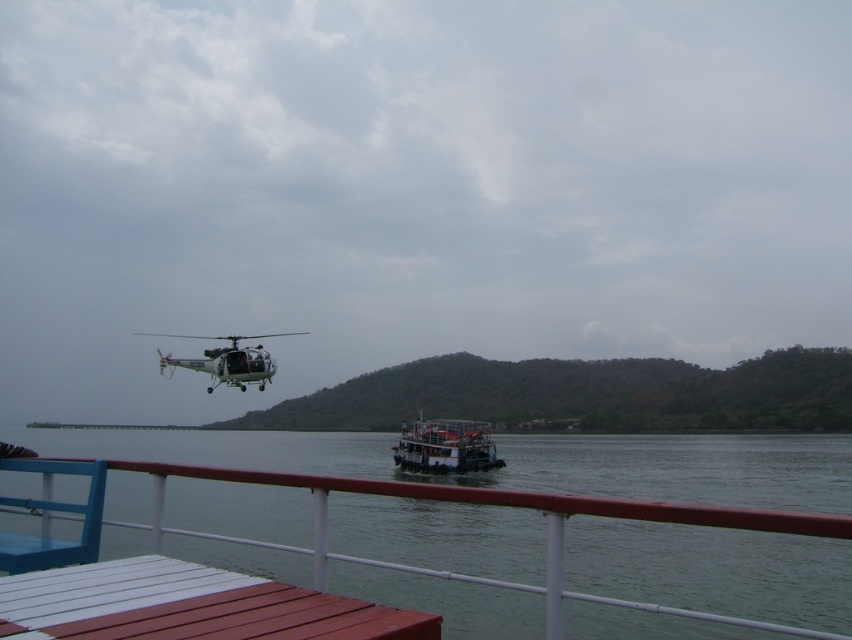
Question: Which object is farther from the camera taking this photo?

Choices:
 (A) white matte boat at center
 (B) white painted wood at lower center
 (C) white matte helicopter at upper center

Answer: (A)

Question: Which point appears closest to the camera in this image?

Choices:
 (A) (176, 566)
 (B) (430, 419)

Answer: (A)

Question: Can you confirm if green water at lower center is positioned to the left of white painted wood at lower center?

Choices:
 (A) no
 (B) yes

Answer: (A)

Question: Does white painted wood at lower center have a greater width compared to white matte boat at center?

Choices:
 (A) yes
 (B) no

Answer: (A)

Question: Considering the real-world distances, which object is farthest from the white matte helicopter at upper center?

Choices:
 (A) white matte boat at center
 (B) green water at lower center

Answer: (A)

Question: In this image, where is white painted wood at lower center located relative to white matte boat at center?

Choices:
 (A) above
 (B) below

Answer: (A)